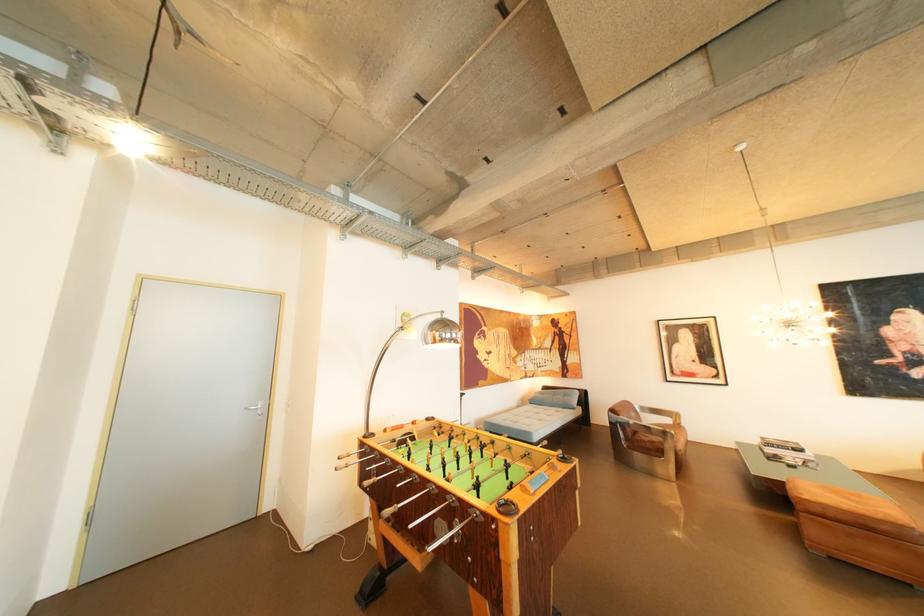
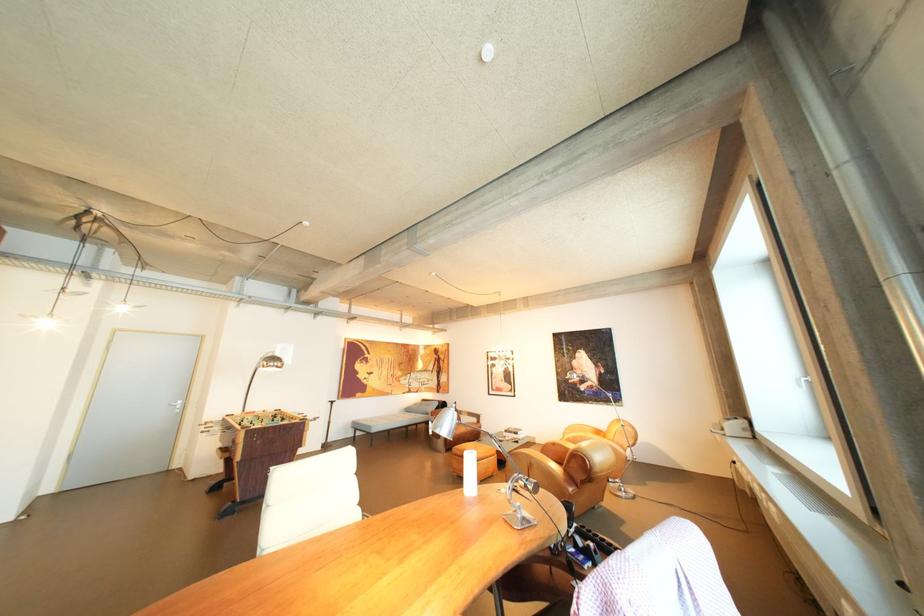
Which direction would the cameraman need to move to produce the second image?

The movement direction of the cameraman is right, backward.